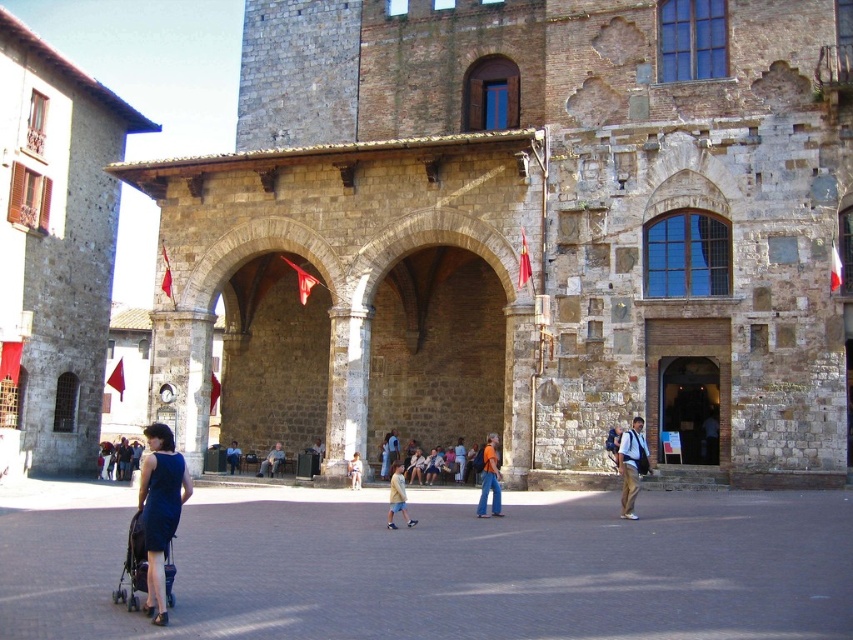
You are standing in the historic town square and see a point marked at coordinates (315,456). Based on the scene described, can you identify what object this point is located on?

The point at coordinates (315,456) is located on the light brown wooden chair at center.

Looking at this image, you are a tourist standing in the town square and want to sit down. You see a light brown wooden chair at center and a light brown wooden bench at center. Which one is higher up?

The light brown wooden chair at center is above the light brown wooden bench at center, so the chair is higher up.